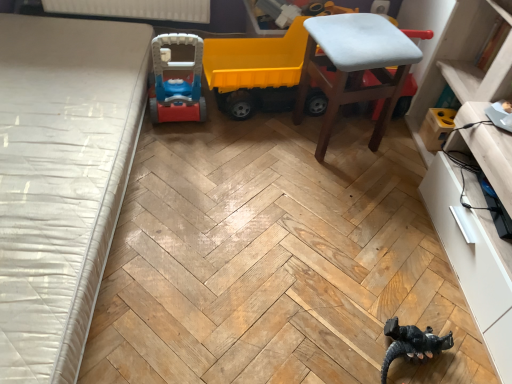
Question: Is light blue fabric stool at upper right not within white textured mattress at left?

Choices:
 (A) no
 (B) yes

Answer: (B)

Question: Is the depth of light blue fabric stool at upper right greater than that of white textured mattress at left?

Choices:
 (A) yes
 (B) no

Answer: (A)

Question: Is white textured mattress at left at the back of light blue fabric stool at upper right?

Choices:
 (A) yes
 (B) no

Answer: (B)

Question: Can you confirm if light blue fabric stool at upper right is smaller than white textured mattress at left?

Choices:
 (A) no
 (B) yes

Answer: (B)

Question: From the image's perspective, does light blue fabric stool at upper right appear lower than white textured mattress at left?

Choices:
 (A) no
 (B) yes

Answer: (A)

Question: From the image's perspective, is light blue fabric stool at upper right located above white textured mattress at left?

Choices:
 (A) yes
 (B) no

Answer: (A)

Question: Does yellow plastic toy truck at center have a larger size compared to white textured mattress at left?

Choices:
 (A) no
 (B) yes

Answer: (A)

Question: Is yellow plastic toy truck at center positioned beyond the bounds of white textured mattress at left?

Choices:
 (A) yes
 (B) no

Answer: (A)

Question: Can you confirm if yellow plastic toy truck at center is thinner than white textured mattress at left?

Choices:
 (A) no
 (B) yes

Answer: (B)

Question: From the image's perspective, is yellow plastic toy truck at center above white textured mattress at left?

Choices:
 (A) yes
 (B) no

Answer: (A)

Question: Can you confirm if yellow plastic toy truck at center is smaller than white textured mattress at left?

Choices:
 (A) no
 (B) yes

Answer: (B)

Question: Can you confirm if yellow plastic toy truck at center is taller than white textured mattress at left?

Choices:
 (A) yes
 (B) no

Answer: (A)

Question: Is white glossy dresser at lower right positioned with its back to yellow plastic toy truck at center?

Choices:
 (A) no
 (B) yes

Answer: (A)